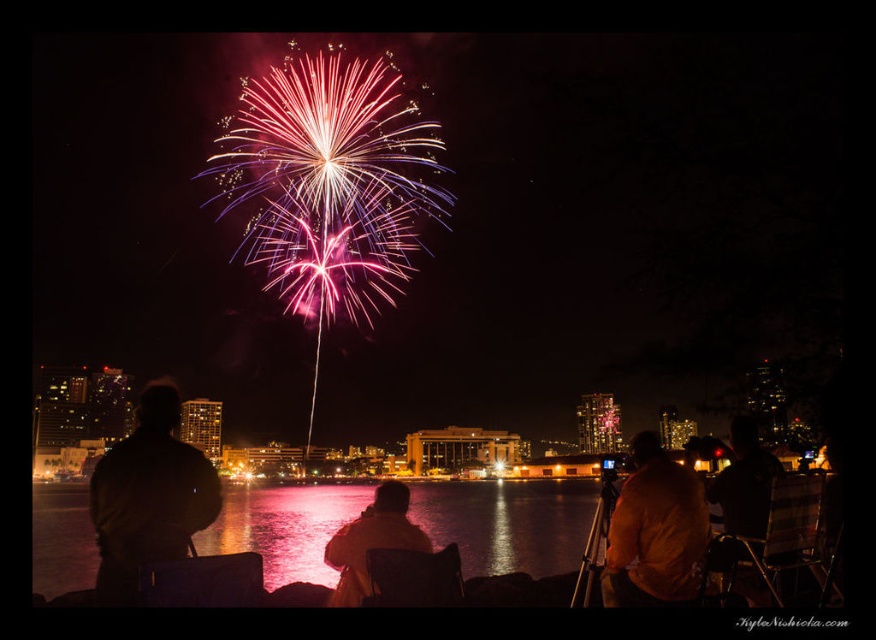
Between glossy reflective water at center and matte yellow jacket at center, which one appears on the left side from the viewer's perspective?

Positioned to the left is glossy reflective water at center.

Is glossy reflective water at center bigger than matte yellow jacket at center?

Yes, glossy reflective water at center is bigger than matte yellow jacket at center.

Does point (514, 524) come behind point (355, 531)?

That is True.

This screenshot has width=876, height=640. I want to click on glossy reflective water at center, so click(x=507, y=522).

Is dark brown leather jacket at left shorter than matte yellow jacket at center?

No.

The width and height of the screenshot is (876, 640). I want to click on dark brown leather jacket at left, so click(x=147, y=497).

Who is positioned more to the left, orange cotton shirt at lower right or matte yellow jacket at center?

From the viewer's perspective, matte yellow jacket at center appears more on the left side.

Can you confirm if orange cotton shirt at lower right is shorter than matte yellow jacket at center?

In fact, orange cotton shirt at lower right may be taller than matte yellow jacket at center.

Measure the distance between point (691, 596) and camera.

Point (691, 596) is 505.98 meters away from camera.

Identify the location of orange cotton shirt at lower right. This screenshot has height=640, width=876. (655, 531).